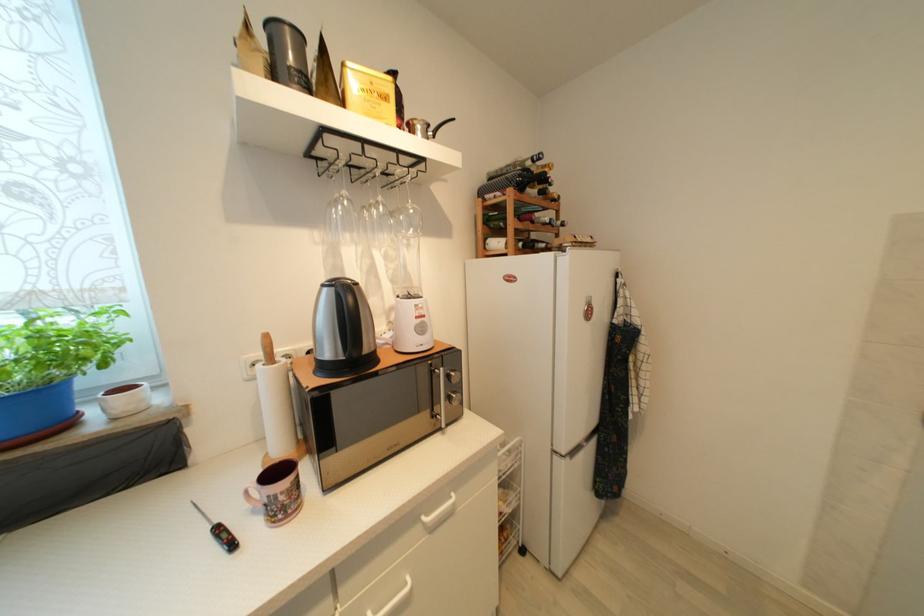
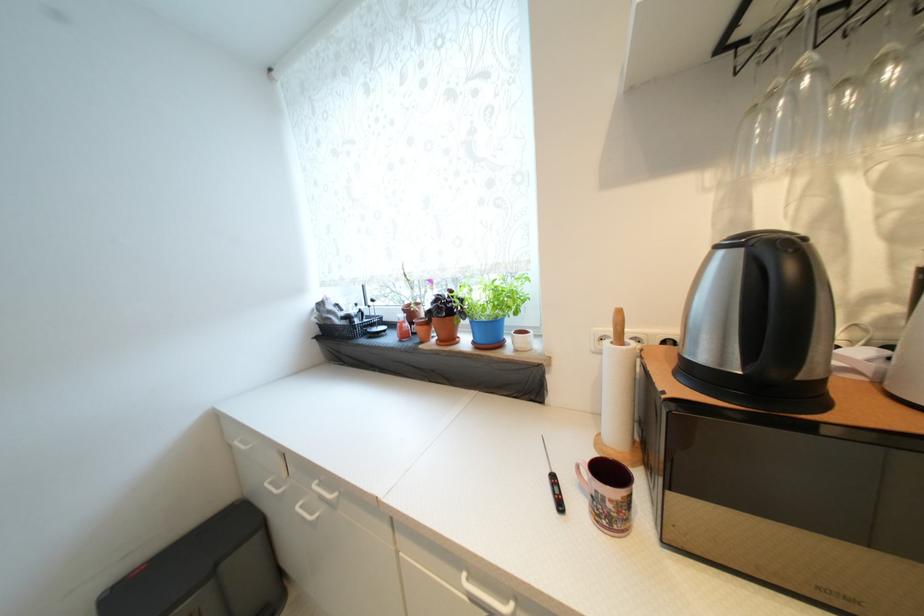
Find the pixel in the second image that matches (x=259, y=513) in the first image.

(586, 488)